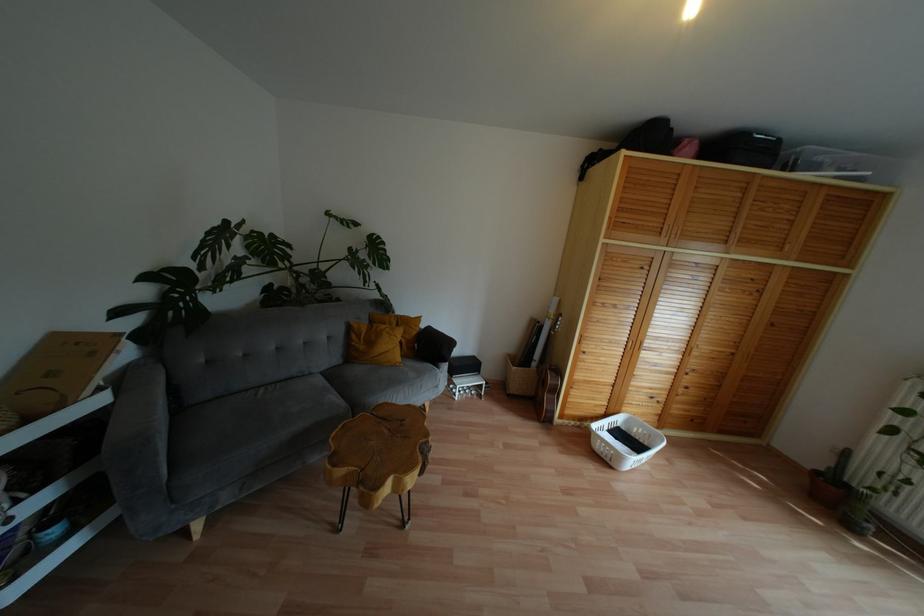
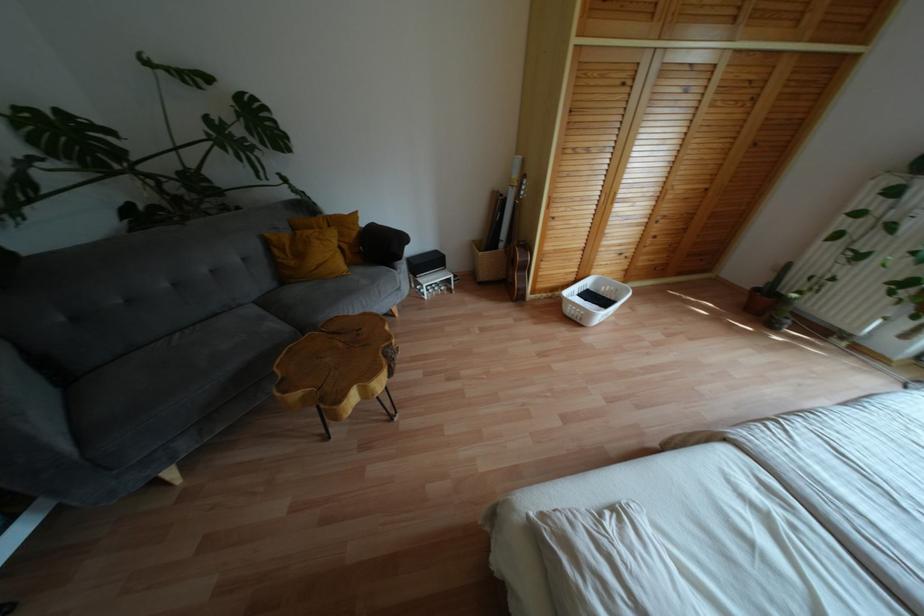
The point at (x=602, y=456) is marked in the first image. Where is the corresponding point in the second image?

(573, 318)